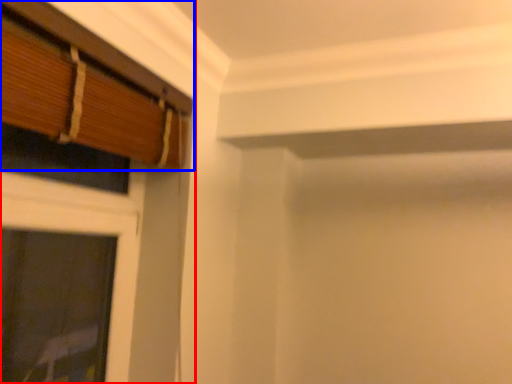
Question: Which of the following is the farthest to the observer, window (highlighted by a red box) or window (highlighted by a blue box)?

Choices:
 (A) window
 (B) window

Answer: (A)